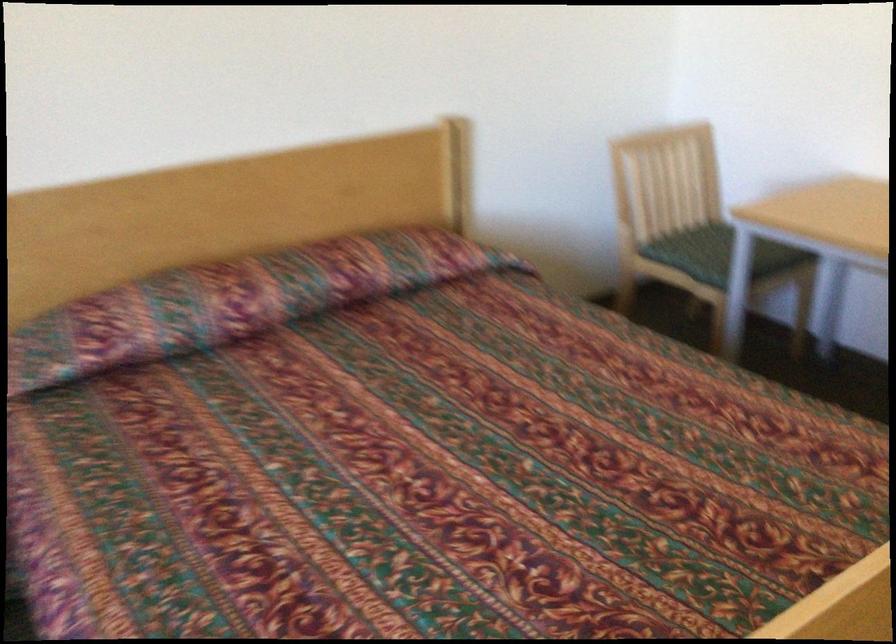
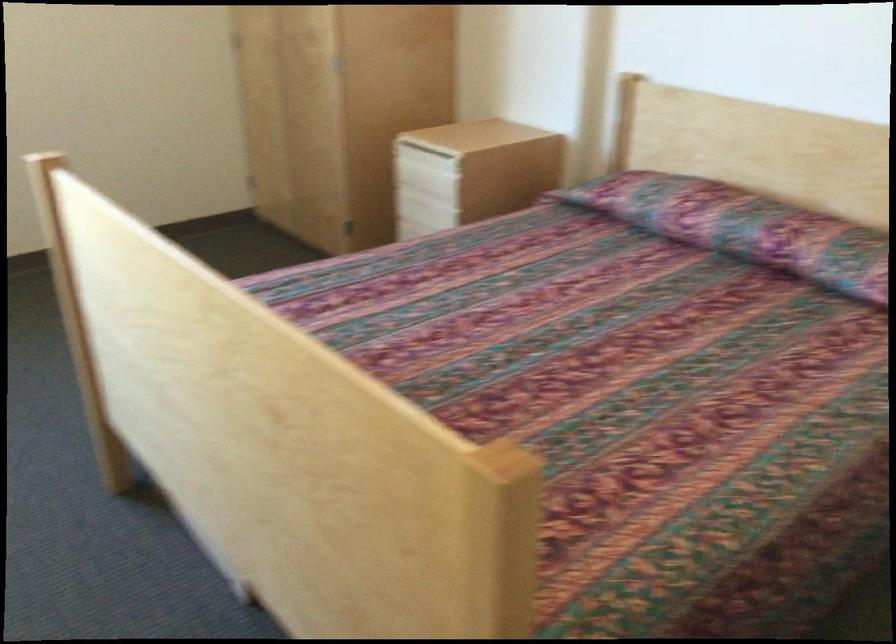
The point at (314, 283) is marked in the first image. Where is the corresponding point in the second image?

(744, 227)